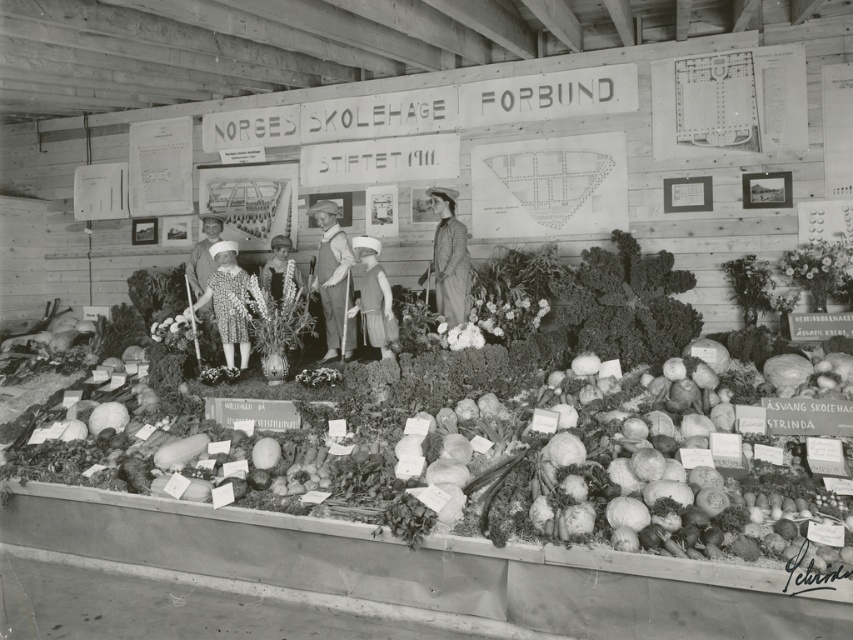
Can you confirm if dress fabric at center is smaller than smooth wooden vase at right?

Actually, dress fabric at center might be larger than smooth wooden vase at right.

Is dress fabric at center wider than smooth wooden vase at right?

Indeed, dress fabric at center has a greater width compared to smooth wooden vase at right.

The width and height of the screenshot is (853, 640). What do you see at coordinates (229, 300) in the screenshot?
I see `dress fabric at center` at bounding box center [229, 300].

What are the coordinates of `dress fabric at center` in the screenshot? It's located at (229, 300).

Can you confirm if smooth white vase at center is positioned to the right of smooth green leaf at upper right?

No, smooth white vase at center is not to the right of smooth green leaf at upper right.

Is smooth white vase at center further to the viewer compared to smooth green leaf at upper right?

No, it is not.

Image resolution: width=853 pixels, height=640 pixels. What are the coordinates of `smooth white vase at center` in the screenshot? It's located at (276, 321).

Is smooth wooden vase at right wider than matte brown dress at center?

Indeed, smooth wooden vase at right has a greater width compared to matte brown dress at center.

Is smooth wooden vase at right shorter than matte brown dress at center?

Indeed, smooth wooden vase at right has a lesser height compared to matte brown dress at center.

Identify the location of smooth wooden vase at right. (817, 268).